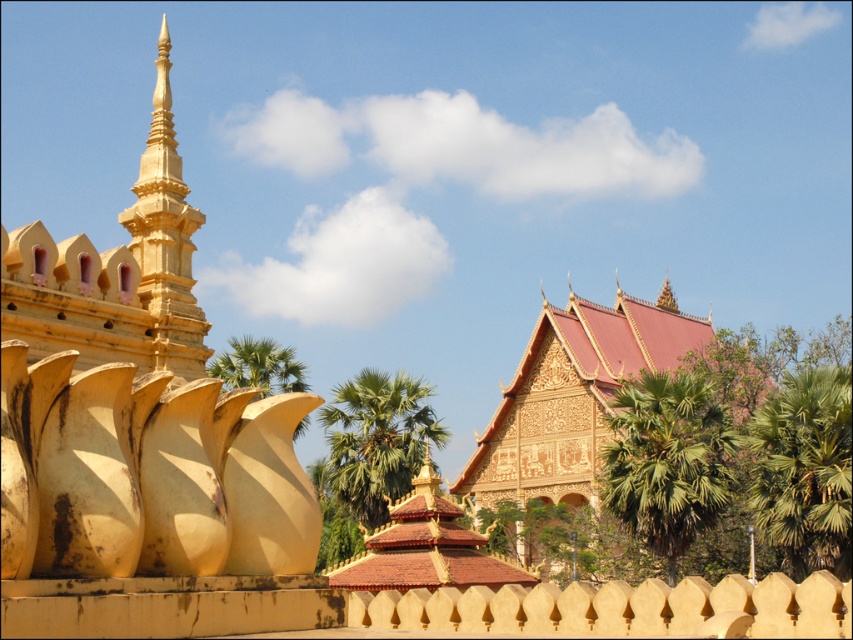
Image resolution: width=853 pixels, height=640 pixels. I want to click on green leafy palm at center, so click(x=259, y=365).

Which of these two, green leafy palm at center or gold textured spire at upper center, stands shorter?

With less height is gold textured spire at upper center.

This screenshot has height=640, width=853. Describe the element at coordinates (259, 365) in the screenshot. I see `green leafy palm at center` at that location.

Where is `green leafy palm at center`? green leafy palm at center is located at coordinates (259, 365).

Measure the distance between golden carved temple at center and camera.

golden carved temple at center and camera are 84.70 meters apart.

Which of these two, golden carved temple at center or matte gold fence at center, stands shorter?

matte gold fence at center

Does point (589, 381) lie in front of point (375, 595)?

That is False.

Locate an element on the screen. This screenshot has width=853, height=640. golden carved temple at center is located at coordinates (592, 396).

Is matte gold fence at center positioned at the back of green leafy palm tree at center-right?

No, it is in front of green leafy palm tree at center-right.

Is matte gold fence at center wider than green leafy palm tree at center-right?

Yes.

Does point (677, 625) come behind point (634, 413)?

No, (677, 625) is in front of (634, 413).

Identify the location of matte gold fence at center. (622, 608).